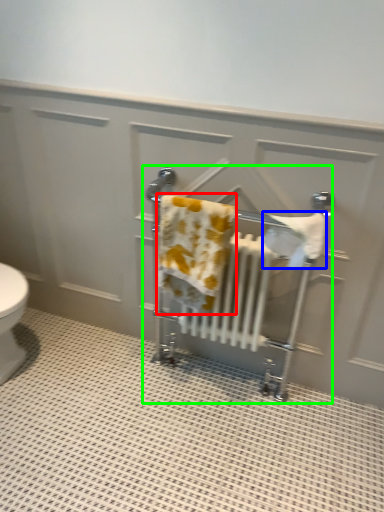
Question: Estimate the real-world distances between objects in this image. Which object is farther from bath towel (highlighted by a red box), bath towel (highlighted by a blue box) or baby carriage (highlighted by a green box)?

Choices:
 (A) bath towel
 (B) baby carriage

Answer: (A)